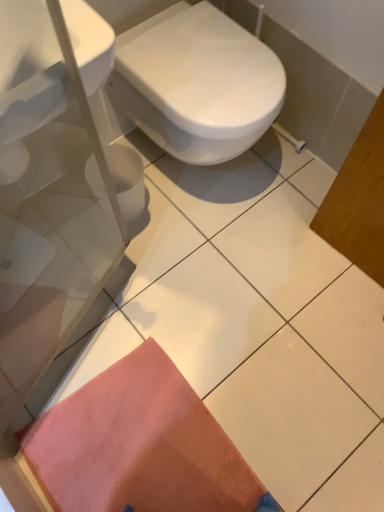
Question: Is the surface of white glossy sink at upper left in direct contact with white glossy bidet at center?

Choices:
 (A) no
 (B) yes

Answer: (A)

Question: Does white glossy sink at upper left appear on the right side of white glossy bidet at center?

Choices:
 (A) yes
 (B) no

Answer: (B)

Question: Considering the relative positions of white glossy sink at upper left and white glossy bidet at center in the image provided, is white glossy sink at upper left to the left of white glossy bidet at center from the viewer's perspective?

Choices:
 (A) yes
 (B) no

Answer: (A)

Question: From a real-world perspective, does white glossy sink at upper left stand above white glossy bidet at center?

Choices:
 (A) no
 (B) yes

Answer: (B)

Question: From the image's perspective, is white glossy sink at upper left located beneath white glossy bidet at center?

Choices:
 (A) yes
 (B) no

Answer: (A)

Question: Are white glossy sink at upper left and white glossy bidet at center located far from each other?

Choices:
 (A) no
 (B) yes

Answer: (A)

Question: Is orange textured mat at lower left oriented towards white glossy sink at upper left?

Choices:
 (A) no
 (B) yes

Answer: (A)

Question: Does orange textured mat at lower left have a lesser height compared to white glossy sink at upper left?

Choices:
 (A) yes
 (B) no

Answer: (A)

Question: From the image's perspective, does orange textured mat at lower left appear lower than white glossy sink at upper left?

Choices:
 (A) no
 (B) yes

Answer: (B)

Question: From a real-world perspective, is orange textured mat at lower left located beneath white glossy sink at upper left?

Choices:
 (A) yes
 (B) no

Answer: (A)

Question: Is orange textured mat at lower left not within white glossy sink at upper left?

Choices:
 (A) yes
 (B) no

Answer: (A)

Question: From the image's perspective, is orange textured mat at lower left over white glossy sink at upper left?

Choices:
 (A) no
 (B) yes

Answer: (A)

Question: From the image's perspective, is white glossy sink at upper left on top of orange textured mat at lower left?

Choices:
 (A) no
 (B) yes

Answer: (B)